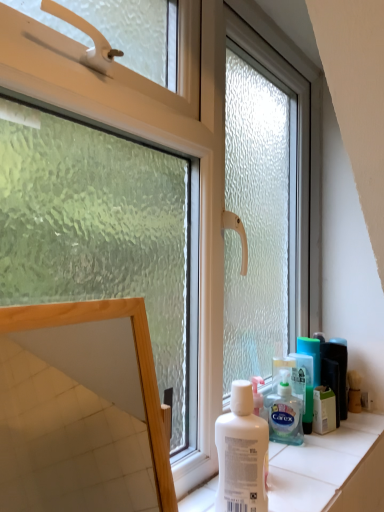
Question: From a real-world perspective, is wooden frame mirror at lower left above or below white matte bottle at center?

Choices:
 (A) above
 (B) below

Answer: (A)

Question: Is point (91, 347) positioned closer to the camera than point (264, 461)?

Choices:
 (A) closer
 (B) farther

Answer: (B)

Question: Which of these objects is positioned closest to the wooden frame mirror at lower left?

Choices:
 (A) green plastic mouthwash at right
 (B) white plastic box at right
 (C) white matte bottle at center
 (D) translucent plastic shaving cream at lower right

Answer: (D)

Question: Estimate the real-world distances between objects in this image. Which object is closer to the white plastic box at right?

Choices:
 (A) translucent plastic shaving cream at lower right
 (B) white matte bottle at center
 (C) green plastic mouthwash at right
 (D) wooden frame mirror at lower left

Answer: (C)